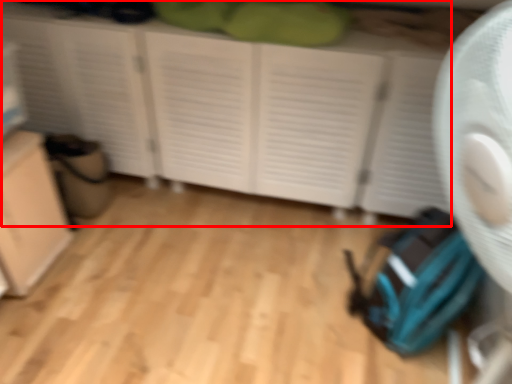
Question: From the image, what is the correct spatial relationship of cupboard (annotated by the red box) in relation to cabinetry?

Choices:
 (A) right
 (B) left

Answer: (A)